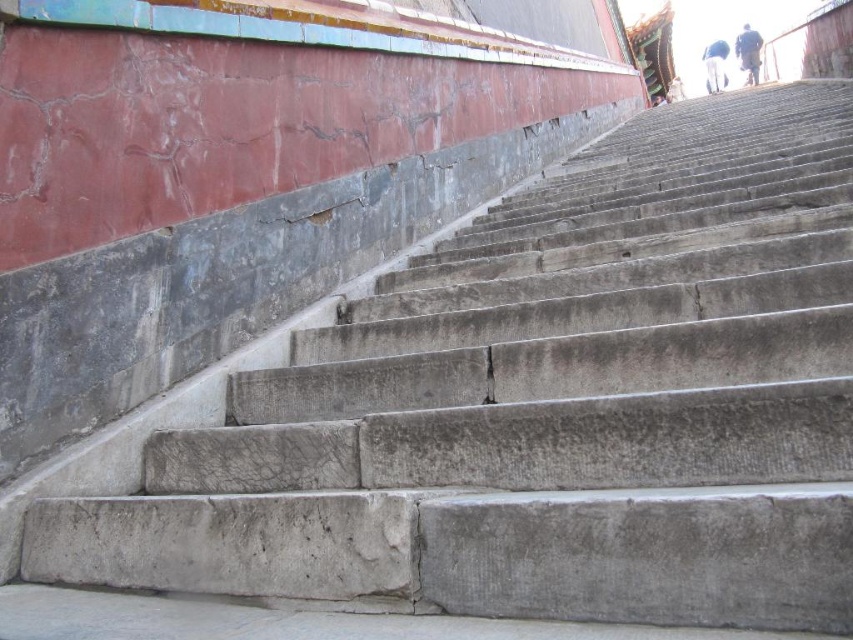
Question: Can you confirm if brown leather pants at upper right is thinner than white cotton pants at upper right?

Choices:
 (A) no
 (B) yes

Answer: (B)

Question: Which of the following is the farthest from the observer?

Choices:
 (A) (705, 68)
 (B) (737, 54)

Answer: (A)

Question: Which object is closer to the camera taking this photo?

Choices:
 (A) brown leather pants at upper right
 (B) white cotton pants at upper right

Answer: (A)

Question: Where is brown leather pants at upper right located in relation to white cotton pants at upper right in the image?

Choices:
 (A) left
 (B) right

Answer: (A)

Question: Does brown leather pants at upper right lie in front of white cotton pants at upper right?

Choices:
 (A) no
 (B) yes

Answer: (B)